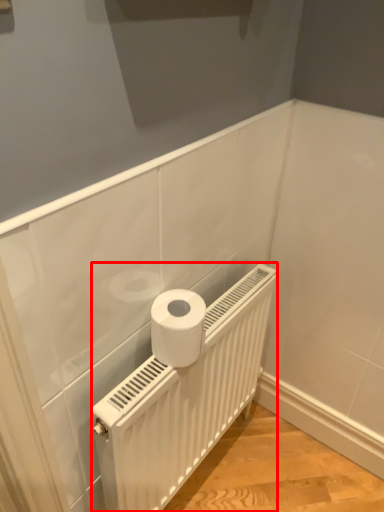
Question: In this image, where is radiator (annotated by the red box) located relative to toilet paper?

Choices:
 (A) left
 (B) right

Answer: (B)